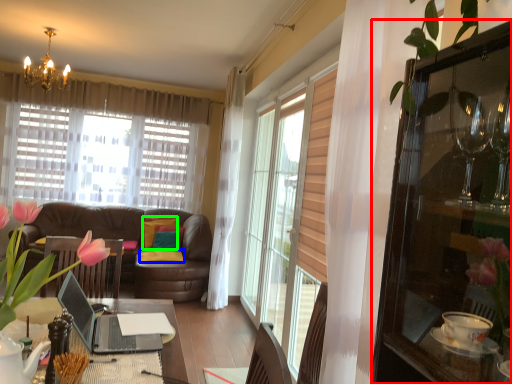
Question: Which object is positioned farthest from cabinetry (highlighted by a red box)? Select from pillow (highlighted by a blue box) and pillow (highlighted by a green box).

Choices:
 (A) pillow
 (B) pillow

Answer: (B)